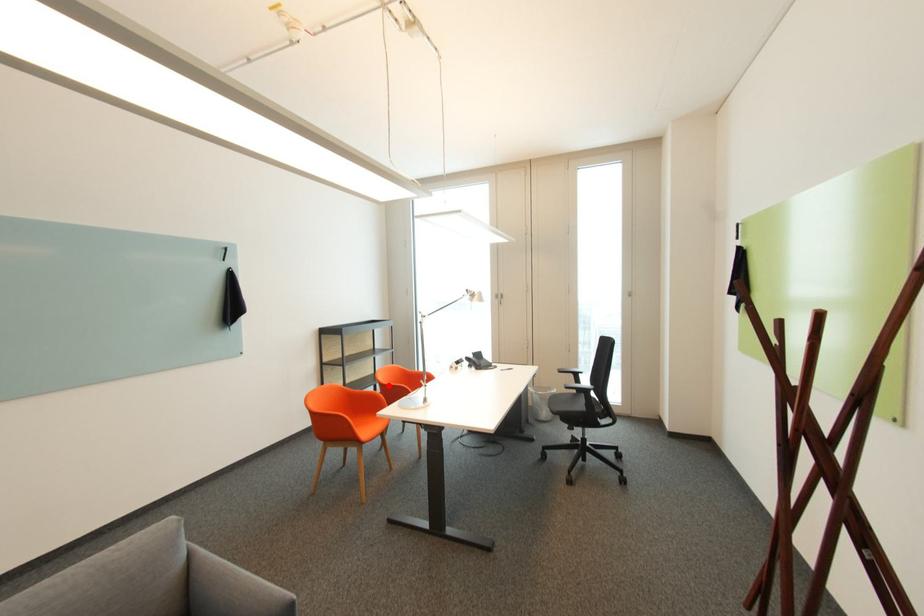
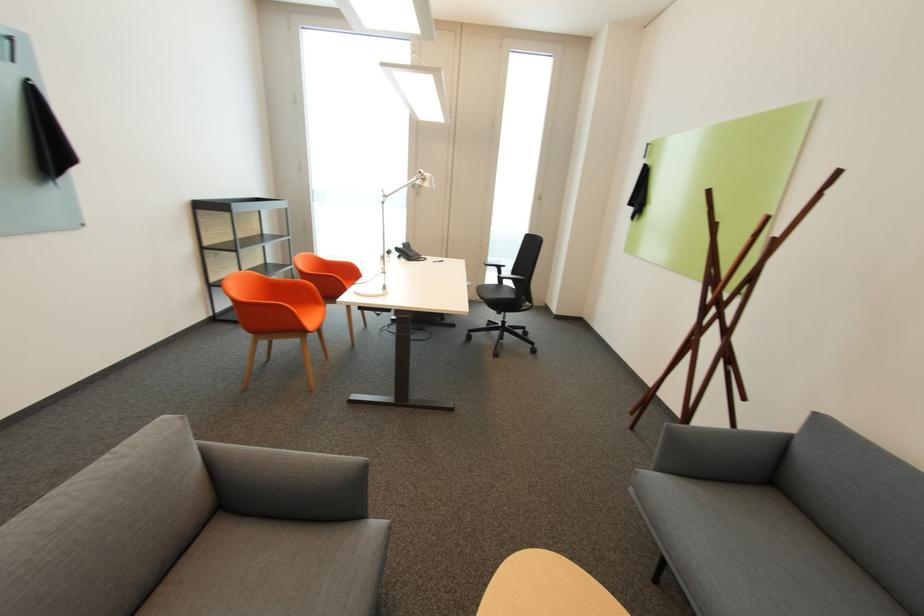
Question: I am providing you with two images of the same scene from different viewpoints. Image1 has a red point marked. In image2, the corresponding 3D location appears at what relative position? Reply with the corresponding letter.

Choices:
 (A) Closer
 (B) Farther

Answer: (A)